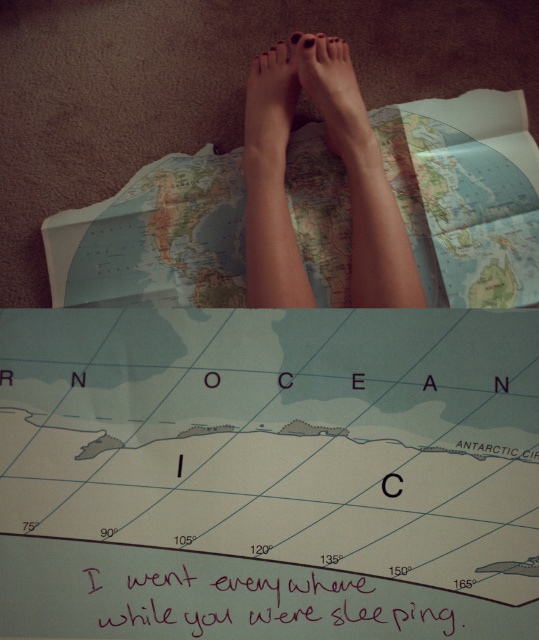
Question: Which object is farther from the camera taking this photo?

Choices:
 (A) matte skin foot at center
 (B) handwritten ink writing at center

Answer: (A)

Question: Among these objects, which one is farthest from the camera?

Choices:
 (A) light blue paper map at center
 (B) matte black foot at center
 (C) smooth skin feet at center
 (D) handwritten ink writing at center

Answer: (B)

Question: Does matte paper map at center have a smaller size compared to smooth skin feet at center?

Choices:
 (A) yes
 (B) no

Answer: (B)

Question: Is handwritten ink writing at center bigger than smooth skin feet at center?

Choices:
 (A) no
 (B) yes

Answer: (A)

Question: Which object is the closest to the matte skin foot at center?

Choices:
 (A) matte black foot at center
 (B) matte paper map at center

Answer: (A)

Question: Is light blue paper map at center thinner than smooth skin feet at center?

Choices:
 (A) no
 (B) yes

Answer: (A)